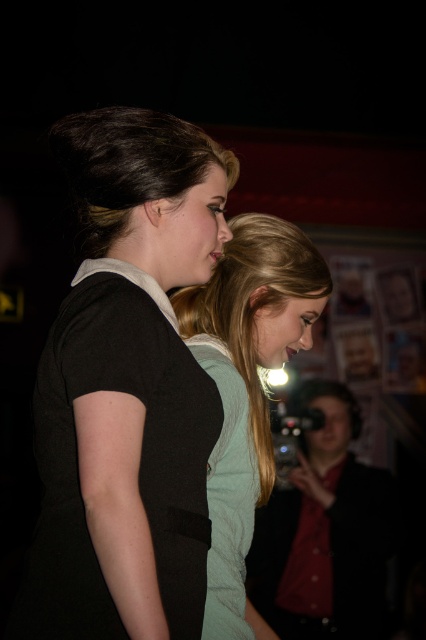
Question: Which point is farther to the camera?

Choices:
 (A) black matte dress at center
 (B) matte black camera at lower right
 (C) light teal fabric dress at center
 (D) light green fabric shirt at center

Answer: (B)

Question: Can you confirm if light green fabric shirt at center is bigger than light teal fabric dress at center?

Choices:
 (A) yes
 (B) no

Answer: (A)

Question: Among these objects, which one is farthest from the camera?

Choices:
 (A) black matte dress at center
 (B) light green fabric shirt at center

Answer: (B)

Question: Is black matte dress at center positioned in front of shiny dark brown hair at upper center?

Choices:
 (A) no
 (B) yes

Answer: (B)

Question: Considering the relative positions of black matte dress at center and light teal fabric dress at center in the image provided, where is black matte dress at center located with respect to light teal fabric dress at center?

Choices:
 (A) left
 (B) right

Answer: (A)

Question: Which object is the farthest from the shiny dark brown hair at upper center?

Choices:
 (A) light green fabric shirt at center
 (B) black matte dress at center

Answer: (A)